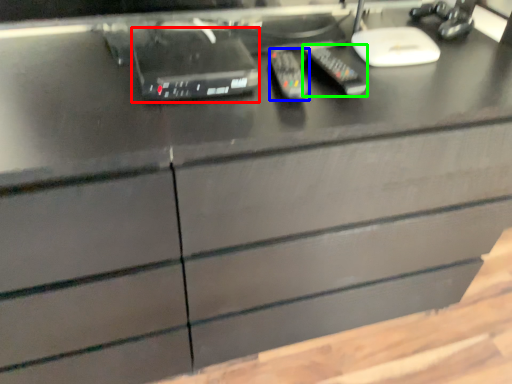
Question: Which object is positioned farthest from equipment (highlighted by a red box)? Select from control (highlighted by a blue box) and control (highlighted by a green box).

Choices:
 (A) control
 (B) control

Answer: (B)